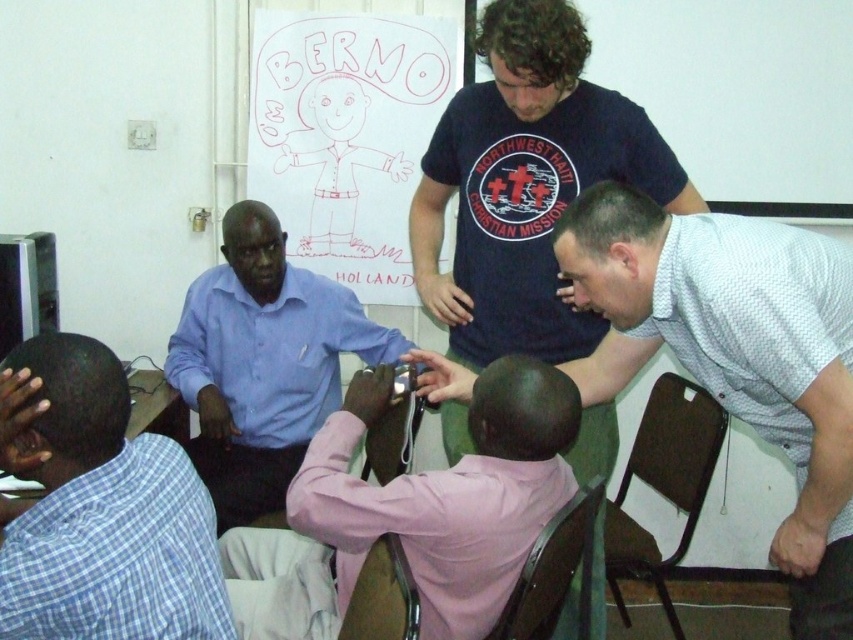
Question: Among these points, which one is nearest to the camera?

Choices:
 (A) (57, 396)
 (B) (339, 630)
 (C) (555, 536)
 (D) (553, 452)

Answer: (A)

Question: Observing the image, what is the correct spatial positioning of brown wooden chair at lower center in reference to wooden chair at lower center?

Choices:
 (A) above
 (B) below

Answer: (B)

Question: Does brown wooden chair at lower right appear on the right side of brown wooden chair at lower center?

Choices:
 (A) yes
 (B) no

Answer: (A)

Question: Which of the following is the farthest from the observer?

Choices:
 (A) (544, 566)
 (B) (370, 515)
 (C) (265, 408)
 (D) (461, 112)

Answer: (C)

Question: Observing the image, what is the correct spatial positioning of brown wooden chair at lower right in reference to brown wooden chair at lower center?

Choices:
 (A) right
 (B) left

Answer: (A)

Question: Which object is farther from the camera taking this photo?

Choices:
 (A) brown wooden chair at lower right
 (B) dark blue t-shirt at center
 (C) blue checkered shirt at lower left

Answer: (A)